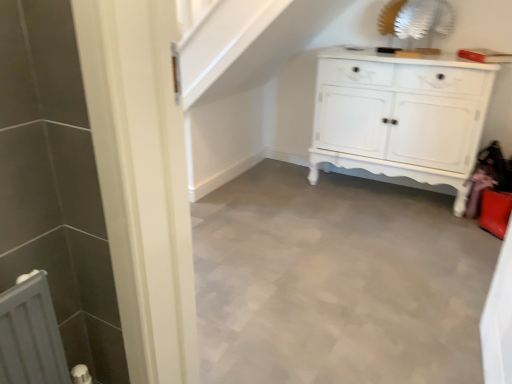
What do you see at coordinates (337, 281) in the screenshot?
I see `smooth gray floor at center` at bounding box center [337, 281].

At what (x,y) coordinates should I click in order to perform the action: click on white matte radiator at lower left. Please return your answer as a coordinate pair (x, y). This screenshot has width=512, height=384. Looking at the image, I should click on (30, 335).

Which is behind, point (324, 50) or point (31, 279)?

The point (324, 50) is more distant.

Locate an element on the screen. Image resolution: width=512 pixels, height=384 pixels. radiator located in front of the white painted wood cabinet at center is located at coordinates (30, 335).

Do you think white painted wood cabinet at center is within white matte radiator at lower left, or outside of it?

white painted wood cabinet at center is spatially situated outside white matte radiator at lower left.

Does white painted wood cabinet at center come behind white matte radiator at lower left?

Yes, white painted wood cabinet at center is behind white matte radiator at lower left.

Does white painted wood cabinet at center turn towards smooth gray floor at center?

Yes.

Is white painted wood cabinet at center bigger or smaller than smooth gray floor at center?

Clearly, white painted wood cabinet at center is larger in size than smooth gray floor at center.

Would you consider white painted wood cabinet at center to be distant from smooth gray floor at center?

No.

Is white painted wood cabinet at center located outside smooth gray floor at center?

Yes.

Considering the sizes of objects white matte radiator at lower left and smooth gray floor at center in the image provided, who is bigger, white matte radiator at lower left or smooth gray floor at center?

With larger size is smooth gray floor at center.

From a real-world perspective, which object rests below the other?

smooth gray floor at center.

Is point (34, 321) closer or farther from the camera than point (365, 372)?

Point (34, 321) is closer to the camera than point (365, 372).

Considering the sizes of objects white matte radiator at lower left and smooth gray floor at center in the image provided, who is wider, white matte radiator at lower left or smooth gray floor at center?

smooth gray floor at center.

Between white matte radiator at lower left and white painted wood cabinet at center, which one has larger width?

With larger width is white painted wood cabinet at center.

From the image's perspective, is white matte radiator at lower left positioned above or below white painted wood cabinet at center?

From the image's perspective, white matte radiator at lower left appears below white painted wood cabinet at center.

Which is correct: white matte radiator at lower left is inside white painted wood cabinet at center, or outside of it?

white matte radiator at lower left cannot be found inside white painted wood cabinet at center.

From their relative heights in the image, would you say smooth gray floor at center is taller or shorter than white matte radiator at lower left?

Considering their sizes, smooth gray floor at center has less height than white matte radiator at lower left.

Which is more distant, (399, 349) or (48, 326)?

The point (399, 349) is more distant.

From the image's perspective, which is below, smooth gray floor at center or white matte radiator at lower left?

white matte radiator at lower left.

Is smooth gray floor at center not within white matte radiator at lower left?

Yes, smooth gray floor at center is located beyond the bounds of white matte radiator at lower left.

From the image's perspective, does smooth gray floor at center appear lower than white painted wood cabinet at center?

Yes.

Between smooth gray floor at center and white painted wood cabinet at center, which one appears on the right side from the viewer's perspective?

Positioned to the right is white painted wood cabinet at center.

How different are the orientations of smooth gray floor at center and white painted wood cabinet at center in degrees?

0.36 degrees.

I want to click on chest of drawers that is on the right side of white matte radiator at lower left, so click(401, 116).

Image resolution: width=512 pixels, height=384 pixels. I want to click on chest of drawers behind the smooth gray floor at center, so pyautogui.click(x=401, y=116).

Which object lies nearer to the anchor point white matte radiator at lower left, smooth gray floor at center or white painted wood cabinet at center?

Based on the image, smooth gray floor at center appears to be nearer to white matte radiator at lower left.

When comparing their distances from white painted wood cabinet at center, does white matte radiator at lower left or smooth gray floor at center seem further?

white matte radiator at lower left lies further to white painted wood cabinet at center than the other object.

Looking at the image, which one is located closer to smooth gray floor at center, white painted wood cabinet at center or white matte radiator at lower left?

Among the two, white painted wood cabinet at center is located nearer to smooth gray floor at center.

Based on their spatial positions, is white matte radiator at lower left or white painted wood cabinet at center further from smooth gray floor at center?

Among the two, white matte radiator at lower left is located further to smooth gray floor at center.

From the image, which object appears to be farther from white painted wood cabinet at center, smooth gray floor at center or white matte radiator at lower left?

white matte radiator at lower left is further to white painted wood cabinet at center.

Which object lies further to the anchor point white matte radiator at lower left, white painted wood cabinet at center or smooth gray floor at center?

white painted wood cabinet at center is positioned further to the anchor white matte radiator at lower left.

Identify the location of plain between white matte radiator at lower left and white painted wood cabinet at center in the front-back direction. This screenshot has height=384, width=512. (337, 281).